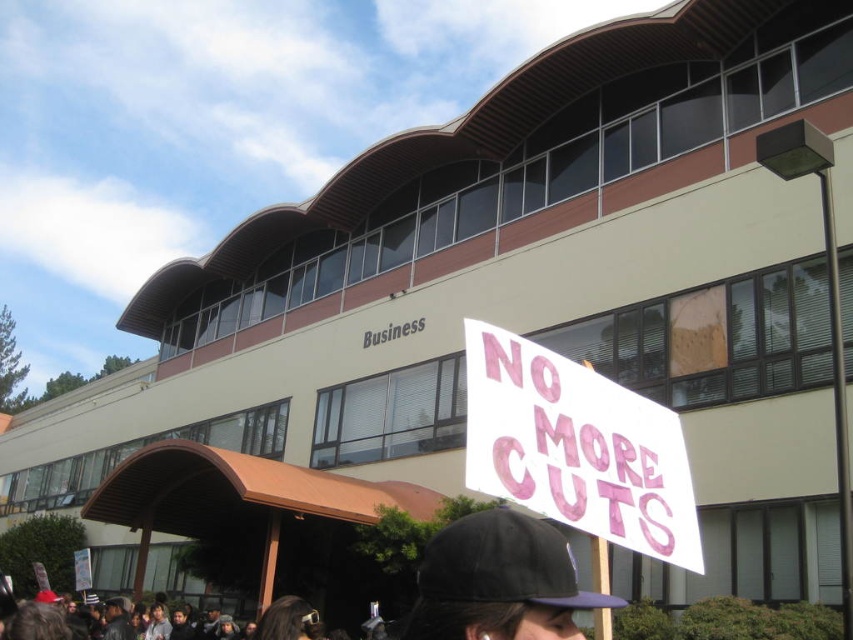
Question: Does white paper sign at center appear under black fabric baseball cap at center?

Choices:
 (A) yes
 (B) no

Answer: (B)

Question: Does white paper sign at center have a larger size compared to black fabric baseball cap at center?

Choices:
 (A) no
 (B) yes

Answer: (B)

Question: Which point appears closest to the camera in this image?

Choices:
 (A) (421, 595)
 (B) (682, 497)

Answer: (A)

Question: Can you confirm if white paper sign at center is positioned to the left of black fabric baseball cap at center?

Choices:
 (A) yes
 (B) no

Answer: (B)

Question: Which of the following is the farthest from the observer?

Choices:
 (A) (561, 461)
 (B) (440, 557)

Answer: (A)